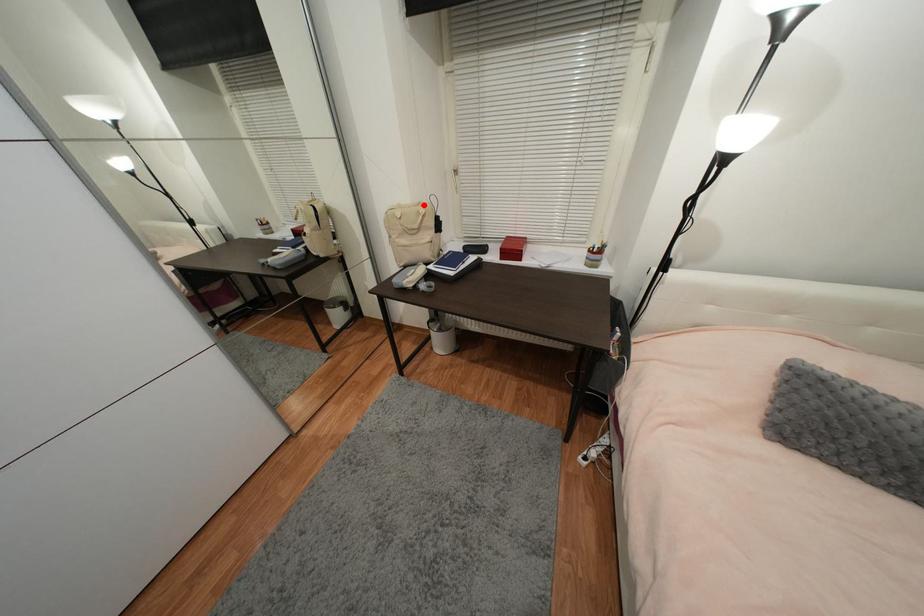
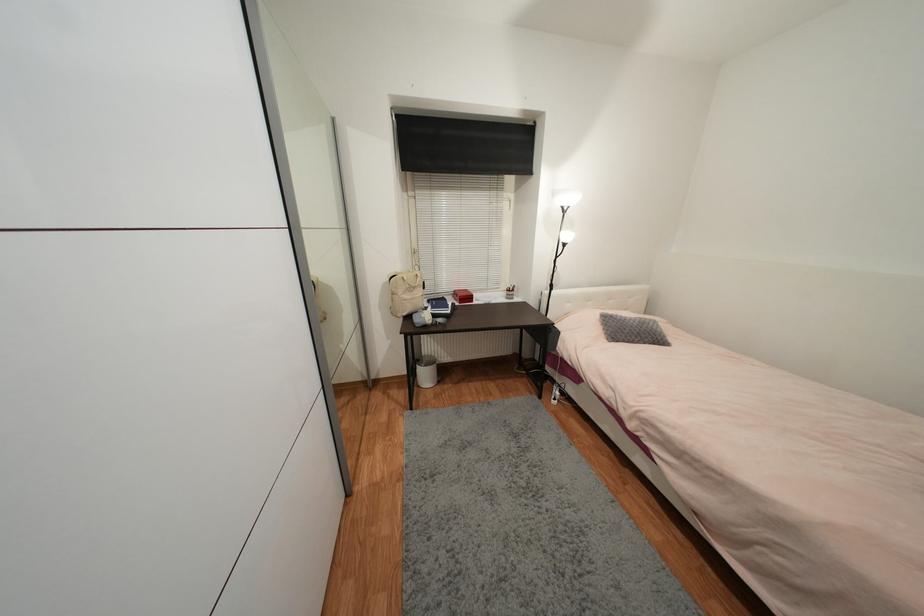
In the second image, find the point that corresponds to the highlighted location in the first image.

(412, 273)